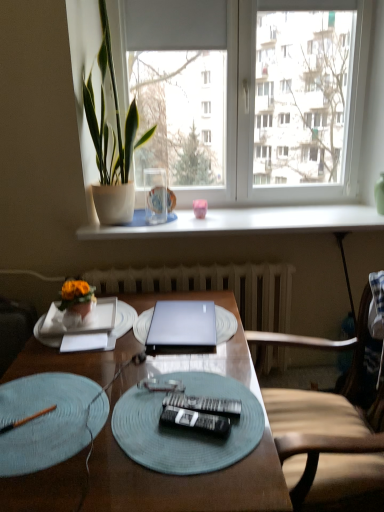
Where is `vacant area on the back side of black plastic remote control at center, marked as the second remote control in a back-to-front arrangement`? This screenshot has height=512, width=384. vacant area on the back side of black plastic remote control at center, marked as the second remote control in a back-to-front arrangement is located at coordinates (194, 381).